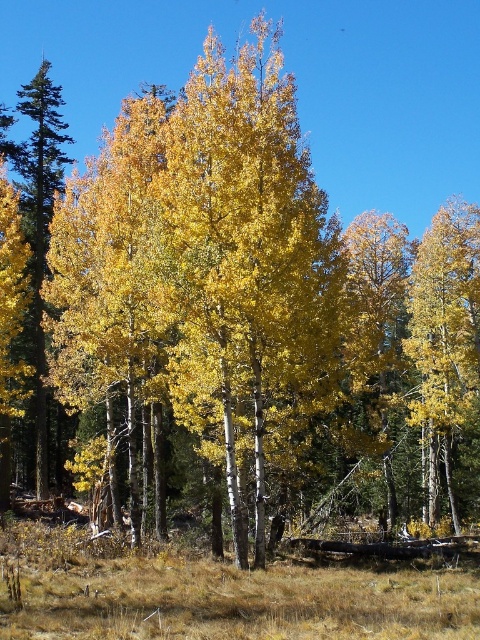
You are a photographer standing at the edge of an autumnal forest. You want to capture a photo of the yellow matte tree at center. If your camera has a maximum focus range of 30 meters, will you be able to focus on the tree?

The distance between the yellow matte tree at center and the camera is 29.17 meters, which is within the camera maximum focus range of 30 meters. Therefore, the camera can focus on the yellow matte tree at center.

You are standing in the autumnal forest scene. There are two points marked in the image. The first point is at coordinates point [435,244], and the second is at point [44,260]. Which of these two points is closer to your current position?

Point [435,244] is closer to the viewer than point [44,260], so the first point is closer to your current position.

You are a painter setting up an easel in the middle of the autumnal forest scene. You want to paint both the yellow matte tree at center and the smooth green pine tree at left. Which tree should you move closer to if you want both trees to appear equally sized in your painting?

You should move closer to the yellow matte tree at center because it has a lesser width compared to the smooth green pine tree at left. By moving closer to the smaller tree, you can balance their apparent sizes in the painting.